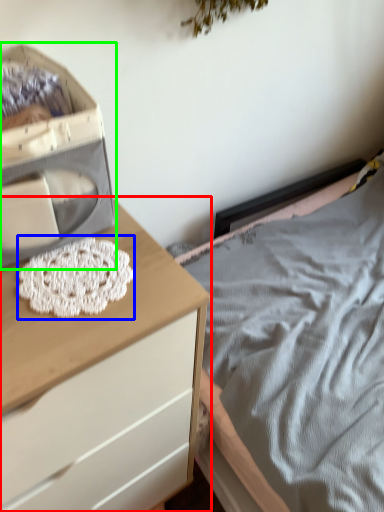
Question: Estimate the real-world distances between objects in this image. Which object is closer to chest of drawers (highlighted by a red box), lace (highlighted by a blue box) or storage box (highlighted by a green box)?

Choices:
 (A) lace
 (B) storage box

Answer: (A)